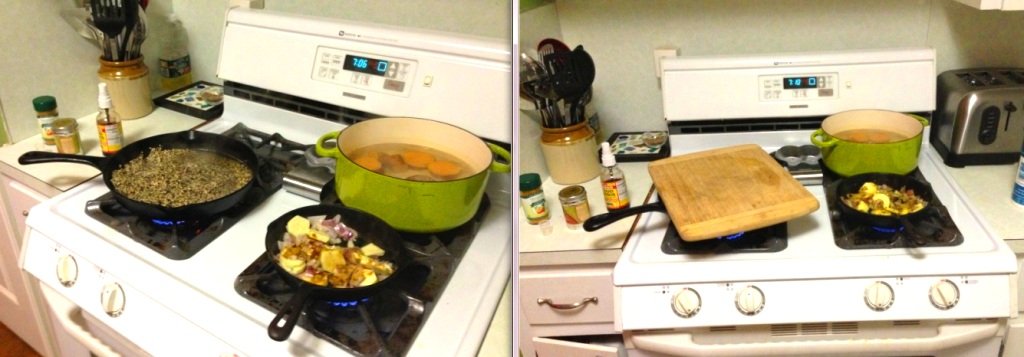
Where is `drawer`? This screenshot has height=357, width=1024. drawer is located at coordinates (561, 283).